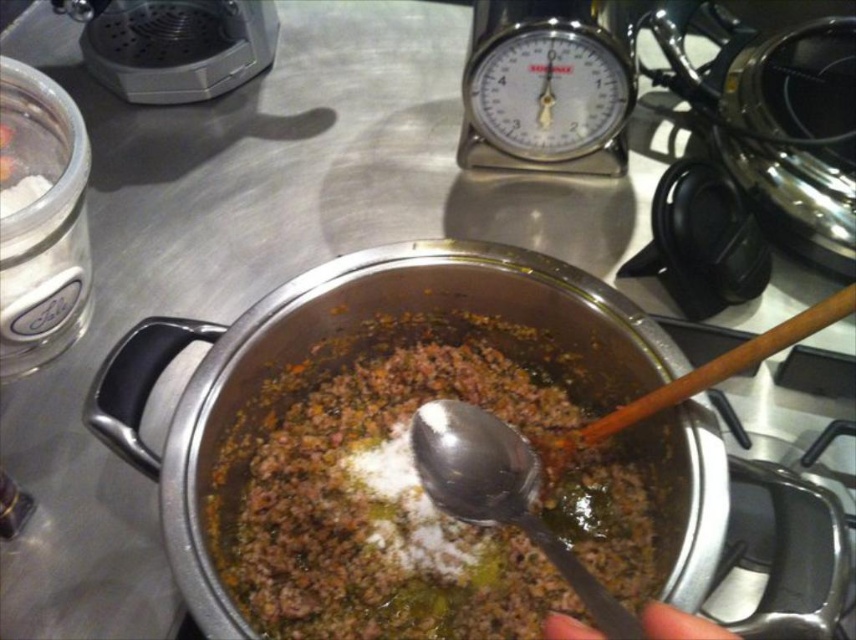
Question: Is brown matte ground meat at center positioned in front of silver metallic spoon at center?

Choices:
 (A) yes
 (B) no

Answer: (B)

Question: Which of the following is the farthest from the observer?

Choices:
 (A) [473, 492]
 (B) [299, 465]

Answer: (B)

Question: Is brown matte ground meat at center above silver metallic spoon at center?

Choices:
 (A) no
 (B) yes

Answer: (B)

Question: Which of the following is the closest to the observer?

Choices:
 (A) (401, 568)
 (B) (412, 435)

Answer: (B)

Question: Is brown matte ground meat at center bigger than silver metallic spoon at center?

Choices:
 (A) yes
 (B) no

Answer: (A)